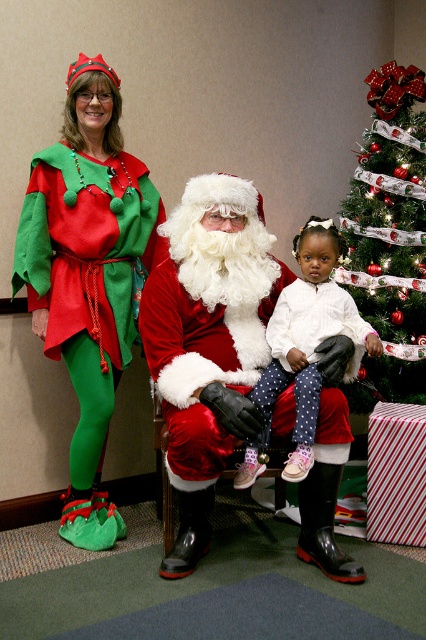
You are a photographer trying to capture a clear photo of the white polka dot pants at center and the green textured fabric christmas tree at right. However, the tree is blocking your view of the pants. Can you adjust your position to see both objects without moving them?

The white polka dot pants at center is behind the green textured fabric christmas tree at right, so you can move to the side of the tree to see both objects.